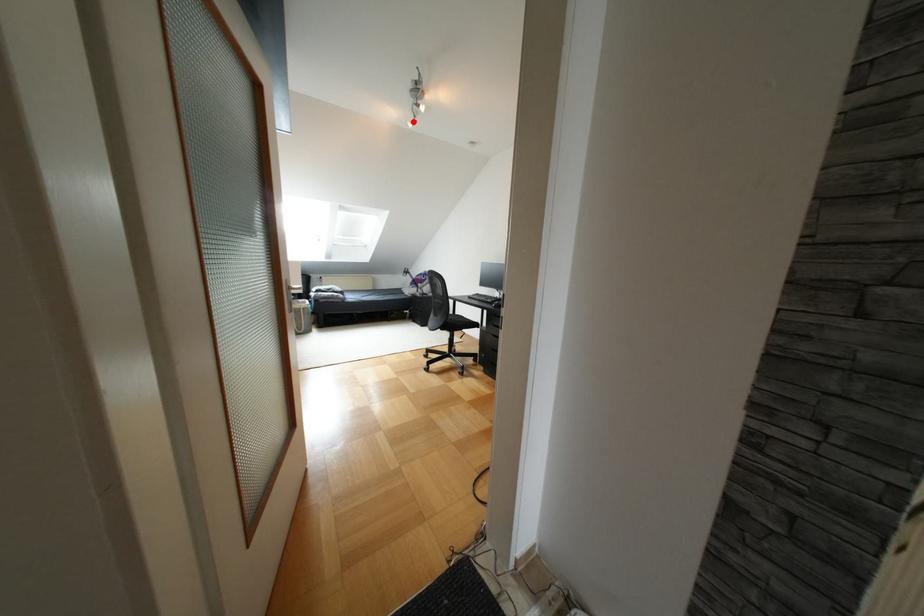
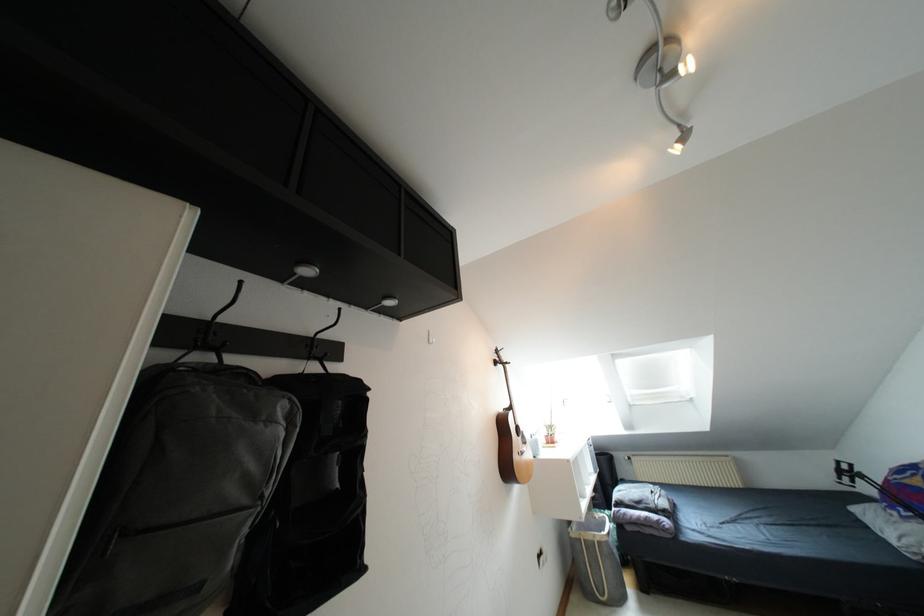
The point at the highlighted location is marked in the first image. Where is the corresponding point in the second image?

(683, 138)